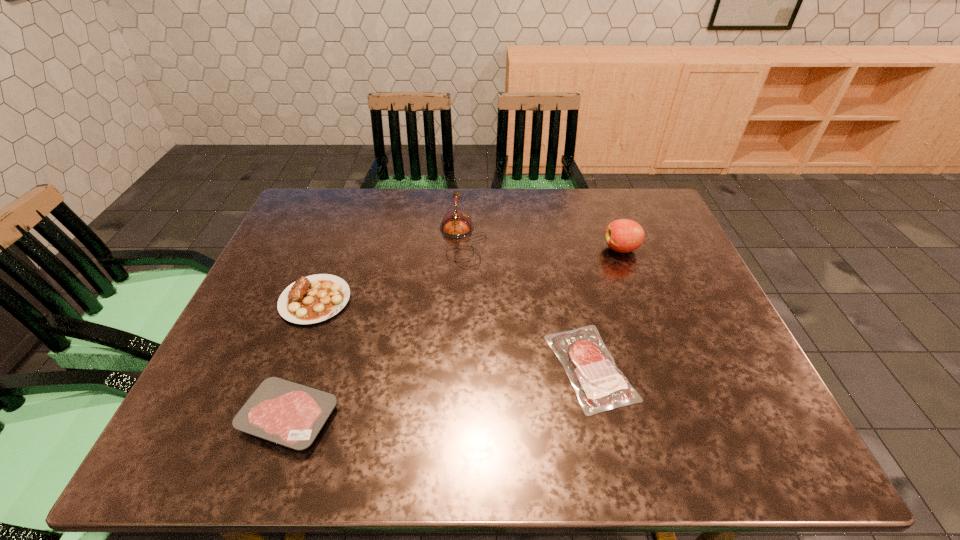
Where is `vacant point located between the tallest steak and the telephone`? The width and height of the screenshot is (960, 540). vacant point located between the tallest steak and the telephone is located at coordinates (389, 270).

The width and height of the screenshot is (960, 540). Identify the location of free space between the third tallest object and the rightmost steak. (453, 334).

You are a GUI agent. You are given a task and a screenshot of the screen. Output one action in this format:
    pyautogui.click(x=<x>, y=<y>)
    Task: Click on the blank region between the fourth object from left to right and the rightmost object
    This screenshot has height=540, width=960.
    Given the screenshot: What is the action you would take?
    pyautogui.click(x=606, y=308)

Select which object is the second closest to the third object from right to left. Please provide its 2D coordinates. Your answer should be formatted as a tuple, i.e. [(x, y)], where the tuple contains the x and y coordinates of a point satisfying the conditions above.

[(599, 384)]

Locate an element on the screen. object that is the closest to the tallest steak is located at coordinates (291, 414).

Locate an element on the screen. steak that is the second closest to the tallest steak is located at coordinates (599, 384).

You are a GUI agent. You are given a task and a screenshot of the screen. Output one action in this format:
    pyautogui.click(x=<x>, y=<y>)
    Task: Click on the steak that is the closest to the tallest steak
    The height and width of the screenshot is (540, 960).
    Given the screenshot: What is the action you would take?
    pyautogui.click(x=291, y=414)

You are a GUI agent. You are given a task and a screenshot of the screen. Output one action in this format:
    pyautogui.click(x=<x>, y=<y>)
    Task: Click on the free space that satisfies the following two spatial constraints: 1. on the back side of the rightmost steak; 2. on the rotary dial of the third object from left to right
    Image resolution: width=960 pixels, height=540 pixels.
    Given the screenshot: What is the action you would take?
    pyautogui.click(x=563, y=240)

Identify the location of free location that satisfies the following two spatial constraints: 1. on the rotary dial of the telephone; 2. on the left side of the rightmost steak. (457, 367).

Where is `vacant point that satisfies the following two spatial constraints: 1. on the back side of the second object from right to left; 2. on the right side of the apple`? vacant point that satisfies the following two spatial constraints: 1. on the back side of the second object from right to left; 2. on the right side of the apple is located at coordinates (564, 249).